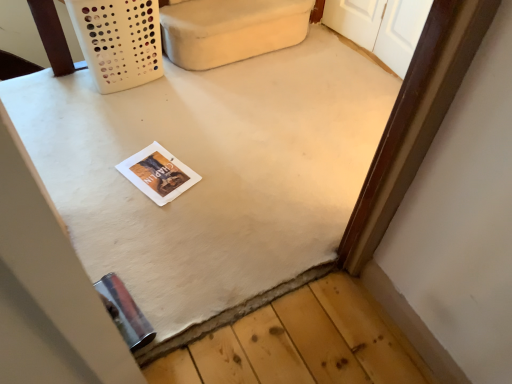
Question: Can you confirm if white matte table at center is taller than white fabric couch at upper center?

Choices:
 (A) no
 (B) yes

Answer: (A)

Question: Is white fabric couch at upper center inside white matte table at center?

Choices:
 (A) yes
 (B) no

Answer: (B)

Question: Can you confirm if white matte table at center is wider than white fabric couch at upper center?

Choices:
 (A) yes
 (B) no

Answer: (A)

Question: Is white matte table at center positioned beyond the bounds of white fabric couch at upper center?

Choices:
 (A) no
 (B) yes

Answer: (B)

Question: From a real-world perspective, is white matte table at center beneath white fabric couch at upper center?

Choices:
 (A) yes
 (B) no

Answer: (A)

Question: Can you confirm if white matte table at center is smaller than white fabric couch at upper center?

Choices:
 (A) no
 (B) yes

Answer: (A)

Question: Is white paper magazine at center positioned before white matte table at center?

Choices:
 (A) no
 (B) yes

Answer: (A)

Question: Is white paper magazine at center bigger than white matte table at center?

Choices:
 (A) no
 (B) yes

Answer: (A)

Question: Is white paper magazine at center facing away from white matte table at center?

Choices:
 (A) no
 (B) yes

Answer: (B)

Question: Could you tell me if white paper magazine at center is turned towards white matte table at center?

Choices:
 (A) no
 (B) yes

Answer: (B)

Question: Is white paper magazine at center thinner than white matte table at center?

Choices:
 (A) yes
 (B) no

Answer: (A)

Question: Is white paper magazine at center positioned behind white matte table at center?

Choices:
 (A) yes
 (B) no

Answer: (A)

Question: Is white paper magazine at center positioned before white fabric couch at upper center?

Choices:
 (A) yes
 (B) no

Answer: (A)